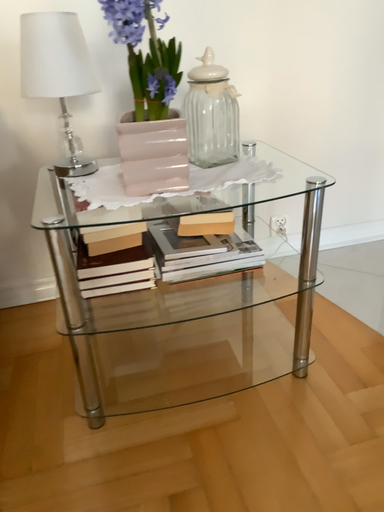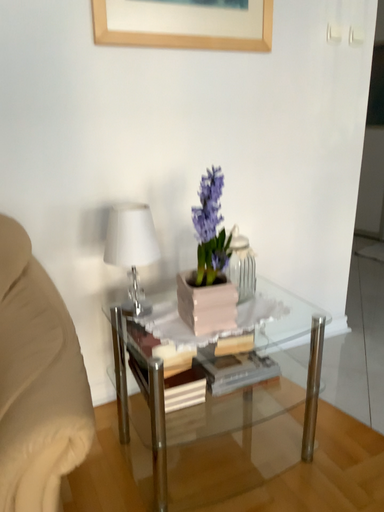
Question: How did the camera likely rotate when shooting the video?

Choices:
 (A) rotated upward
 (B) rotated downward

Answer: (A)